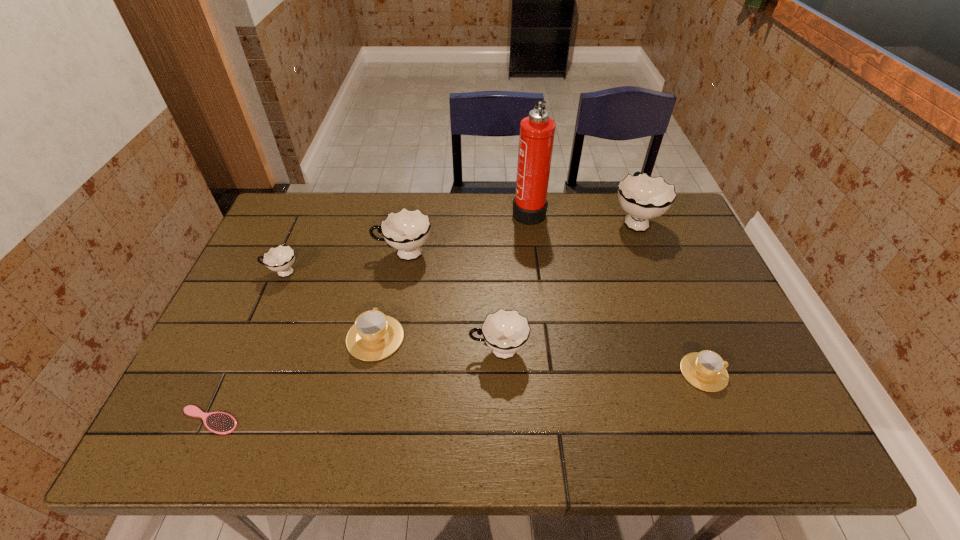
This screenshot has height=540, width=960. I want to click on cup at the left edge, so click(280, 259).

The height and width of the screenshot is (540, 960). Find the location of `hairbrush at the left edge`. hairbrush at the left edge is located at coordinates (222, 423).

The image size is (960, 540). I want to click on object that is at the near left corner, so click(222, 423).

The width and height of the screenshot is (960, 540). I want to click on object located at the far right corner, so [643, 197].

Identify the location of vacant space at the far edge. The height and width of the screenshot is (540, 960). (357, 202).

The image size is (960, 540). I want to click on free space at the near edge, so click(521, 421).

Identify the location of vacant space at the left edge of the desktop. (198, 370).

Where is `vacant area at the far left corner`? vacant area at the far left corner is located at coordinates (317, 232).

Where is `free point between the second biggest white cup and the tallest cup`? Image resolution: width=960 pixels, height=540 pixels. free point between the second biggest white cup and the tallest cup is located at coordinates (519, 237).

You are a GUI agent. You are given a task and a screenshot of the screen. Output one action in this format:
    pyautogui.click(x=<x>, y=<y>)
    Task: Click on the blank region between the fire extinguisher and the second white cup from left to right
    The image size is (960, 540).
    Given the screenshot: What is the action you would take?
    pyautogui.click(x=467, y=232)